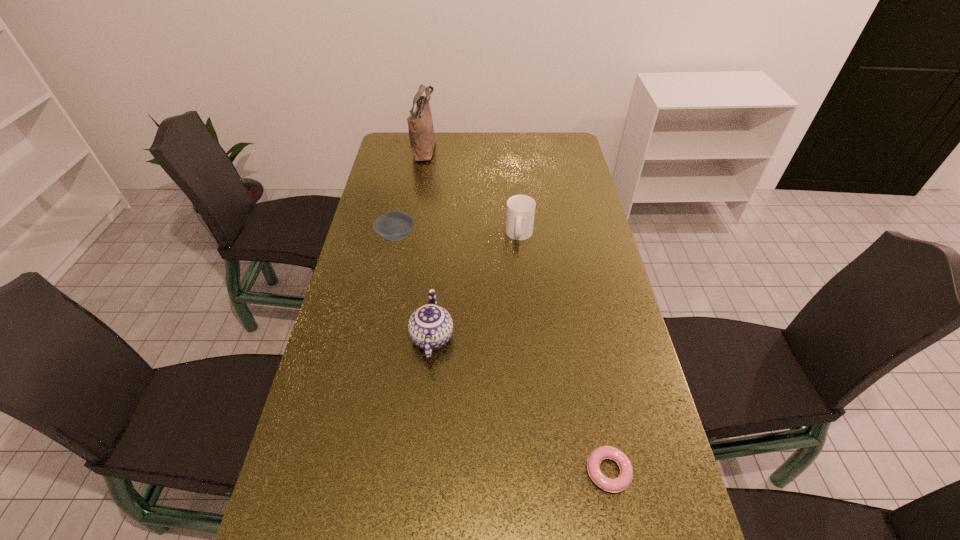
Where is `empty space that is in between the shortest object and the fourth object from left to right`? empty space that is in between the shortest object and the fourth object from left to right is located at coordinates (564, 353).

The height and width of the screenshot is (540, 960). I want to click on blank region between the second shortest object and the chinaware, so click(x=414, y=287).

Identify the location of object that stands as the closest to the second shortest object. Image resolution: width=960 pixels, height=540 pixels. (430, 327).

Point out which object is positioned as the fourth nearest to the second object from right to left. Please provide its 2D coordinates. Your answer should be formatted as a tuple, i.e. [(x, y)], where the tuple contains the x and y coordinates of a point satisfying the conditions above.

[(615, 485)]

Find the location of a particular element. The width and height of the screenshot is (960, 540). free region that satisfies the following two spatial constraints: 1. on the front-facing side of the farthest object; 2. on the left side of the doughnut is located at coordinates (371, 471).

Identify the location of free space that satisfies the following two spatial constraints: 1. on the handle side of the nearest object; 2. on the left side of the second object from right to left. (541, 471).

Find the location of a particular element. The width and height of the screenshot is (960, 540). free space in the image that satisfies the following two spatial constraints: 1. on the front-facing side of the tallest object; 2. on the left side of the nearest object is located at coordinates (371, 471).

This screenshot has width=960, height=540. Find the location of `free space that satisfies the following two spatial constraints: 1. on the handle side of the mug; 2. on the right side of the nearest object`. free space that satisfies the following two spatial constraints: 1. on the handle side of the mug; 2. on the right side of the nearest object is located at coordinates (541, 471).

Locate an element on the screen. This screenshot has width=960, height=540. vacant region that satisfies the following two spatial constraints: 1. on the front-facing side of the farthest object; 2. on the front side of the bowl is located at coordinates (410, 237).